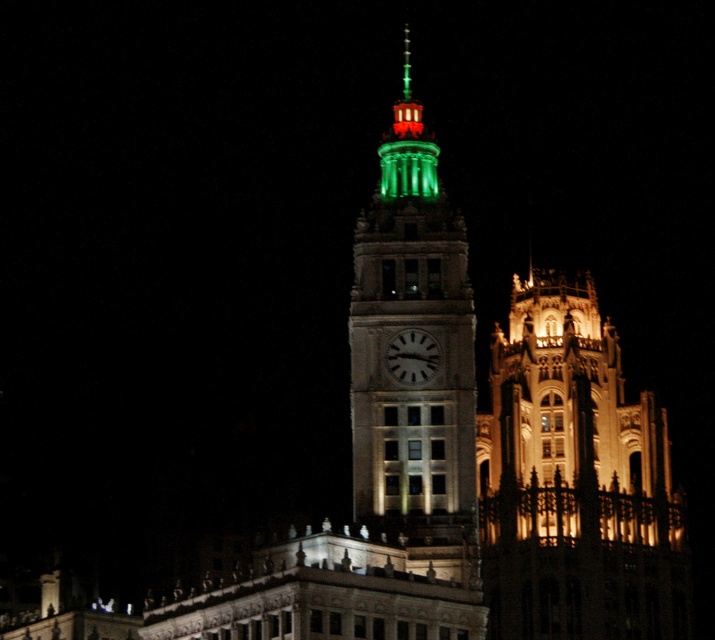
Which is behind, point (543, 513) or point (409, 353)?

Point (543, 513)

Who is positioned more to the left, illuminated stone tower at right or white glossy clock at center?

From the viewer's perspective, white glossy clock at center appears more on the left side.

Does point (495, 636) come farther from viewer compared to point (388, 349)?

Yes, point (495, 636) is behind point (388, 349).

Find the location of a particular element. Image resolution: width=715 pixels, height=640 pixels. illuminated stone tower at right is located at coordinates (576, 480).

Which of these two, green glass spire at upper center or white glossy clock at center, stands taller?

green glass spire at upper center is taller.

Looking at this image, can you confirm if green glass spire at upper center is shorter than white glossy clock at center?

In fact, green glass spire at upper center may be taller than white glossy clock at center.

Does point (400, 109) lie in front of point (429, 337)?

No.

Where is `green glass spire at upper center`? Image resolution: width=715 pixels, height=640 pixels. green glass spire at upper center is located at coordinates (408, 147).

Who is taller, green illuminated clock tower at center or green glass spire at upper center?

green illuminated clock tower at center

Is point (450, 472) more distant than point (403, 49)?

That is False.

Identify the location of green illuminated clock tower at center. (418, 328).